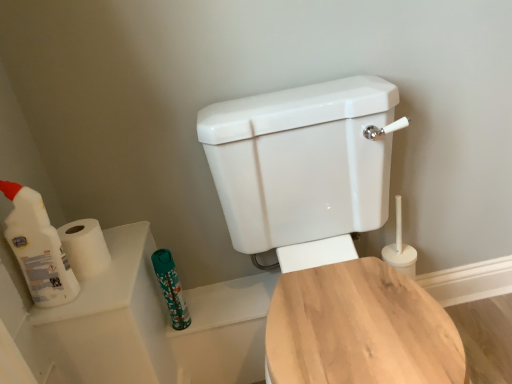
Question: Can you confirm if white matte toilet paper at left is positioned to the right of white glossy toilet at center, acting as the 1th toilet starting from the front?

Choices:
 (A) yes
 (B) no

Answer: (B)

Question: Is white matte toilet paper at left outside white glossy toilet at center, acting as the 1th toilet starting from the front?

Choices:
 (A) no
 (B) yes

Answer: (B)

Question: From the image's perspective, is white matte toilet paper at left over white glossy toilet at center, placed as the 2th toilet when sorted from back to front?

Choices:
 (A) no
 (B) yes

Answer: (B)

Question: Is white matte toilet paper at left taller than white glossy toilet at center, acting as the 1th toilet starting from the front?

Choices:
 (A) no
 (B) yes

Answer: (A)

Question: Is white matte toilet paper at left thinner than white glossy toilet at center, acting as the 1th toilet starting from the front?

Choices:
 (A) yes
 (B) no

Answer: (A)

Question: From the image's perspective, does white matte toilet paper at left appear lower than white glossy toilet at center, acting as the 1th toilet starting from the front?

Choices:
 (A) no
 (B) yes

Answer: (A)

Question: Could wooden toilet seat at center, which is the second toilet in front-to-back order, be considered to be inside white glossy toilet at center, acting as the 1th toilet starting from the front?

Choices:
 (A) no
 (B) yes

Answer: (A)

Question: Is white glossy toilet at center, acting as the 1th toilet starting from the front, in front of wooden toilet seat at center, which is the second toilet in front-to-back order?

Choices:
 (A) no
 (B) yes

Answer: (B)

Question: Are white glossy toilet at center, placed as the 2th toilet when sorted from back to front, and wooden toilet seat at center, which is the second toilet in front-to-back order, beside each other?

Choices:
 (A) yes
 (B) no

Answer: (A)

Question: From a real-world perspective, is white glossy toilet at center, placed as the 2th toilet when sorted from back to front, beneath wooden toilet seat at center, which is the second toilet in front-to-back order?

Choices:
 (A) no
 (B) yes

Answer: (A)

Question: From the image's perspective, is white glossy toilet at center, acting as the 1th toilet starting from the front, on top of wooden toilet seat at center, arranged as the 1th toilet when viewed from the back?

Choices:
 (A) no
 (B) yes

Answer: (B)

Question: Does white glossy toilet at center, acting as the 1th toilet starting from the front, appear on the left side of wooden toilet seat at center, which is the second toilet in front-to-back order?

Choices:
 (A) no
 (B) yes

Answer: (B)

Question: From the image's perspective, is wooden toilet seat at center, arranged as the 1th toilet when viewed from the back, under teal fabric toiletry at lower center?

Choices:
 (A) yes
 (B) no

Answer: (A)